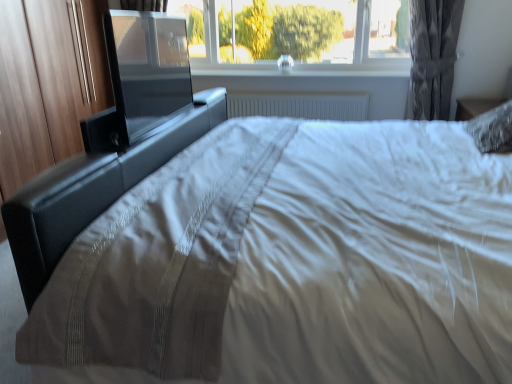
What is the approximate width of white plastic radiator at center?

The width of white plastic radiator at center is 9.64 centimeters.

At what (x,y) coordinates should I click in order to perform the action: click on white plastic radiator at center. Please return your answer as a coordinate pair (x, y). Looking at the image, I should click on (298, 105).

From a real-world perspective, is transparent glass window at upper center above or below white plastic radiator at center?

In terms of real-world spatial position, transparent glass window at upper center is above white plastic radiator at center.

Measure the distance from transparent glass window at upper center to white plastic radiator at center.

transparent glass window at upper center and white plastic radiator at center are 19.31 inches apart.

Is transparent glass window at upper center turned away from white plastic radiator at center?

transparent glass window at upper center does not have its back to white plastic radiator at center.

There is a white plastic radiator at center. In order to click on window above it (from a real-world perspective) in this screenshot , I will do `click(295, 31)`.

Looking at their sizes, would you say white plastic radiator at center is wider or thinner than gray textured curtain at upper right?

Clearly, white plastic radiator at center has less width compared to gray textured curtain at upper right.

Who is bigger, white plastic radiator at center or gray textured curtain at upper right?

Bigger between the two is gray textured curtain at upper right.

How different are the orientations of white plastic radiator at center and gray textured curtain at upper right in degrees?

The angular difference between white plastic radiator at center and gray textured curtain at upper right is 0.403 degrees.

Considering the positions of objects white plastic radiator at center and gray textured curtain at upper right in the image provided, who is behind, white plastic radiator at center or gray textured curtain at upper right?

white plastic radiator at center is more distant.

Considering the relative sizes of black leather bed frame at center and black glossy screen door at upper left in the image provided, is black leather bed frame at center smaller than black glossy screen door at upper left?

Actually, black leather bed frame at center might be larger than black glossy screen door at upper left.

Would you consider black leather bed frame at center to be distant from black glossy screen door at upper left?

No, there isn't a large distance between black leather bed frame at center and black glossy screen door at upper left.

Locate an element on the screen. This screenshot has width=512, height=384. screen door that appears above the black leather bed frame at center (from a real-world perspective) is located at coordinates (147, 69).

Looking at this image, who is shorter, gray textured curtain at upper right or transparent glass window at upper center?

transparent glass window at upper center.

Is gray textured curtain at upper right placed right next to transparent glass window at upper center?

No.

Looking at this image, is gray textured curtain at upper right smaller than transparent glass window at upper center?

Correct, gray textured curtain at upper right occupies less space than transparent glass window at upper center.

Identify the location of curtain on the right of transparent glass window at upper center. The width and height of the screenshot is (512, 384). (433, 55).

Which object is closer to the camera taking this photo, white plastic radiator at center or black leather bed frame at center?

black leather bed frame at center.

Which object is positioned more to the left, white plastic radiator at center or black leather bed frame at center?

Positioned to the left is black leather bed frame at center.

Would you say white plastic radiator at center is a long distance from black leather bed frame at center?

Yes, white plastic radiator at center and black leather bed frame at center are located far from each other.

Does point (131, 153) lie behind point (447, 90)?

No.

In the scene shown: Considering the relative positions of black leather bed frame at center and gray textured curtain at upper right in the image provided, is black leather bed frame at center to the right of gray textured curtain at upper right from the viewer's perspective?

Incorrect, black leather bed frame at center is not on the right side of gray textured curtain at upper right.

Is black leather bed frame at center situated inside gray textured curtain at upper right or outside?

The correct answer is: outside.

Considering their positions, is black glossy screen door at upper left located in front of or behind transparent glass window at upper center?

In the image, black glossy screen door at upper left appears in front of transparent glass window at upper center.

Is black glossy screen door at upper left bigger or smaller than transparent glass window at upper center?

Clearly, black glossy screen door at upper left is smaller in size than transparent glass window at upper center.

How different are the orientations of black glossy screen door at upper left and transparent glass window at upper center in degrees?

black glossy screen door at upper left and transparent glass window at upper center are facing 89.6 degrees away from each other.

From the image's perspective, would you say black glossy screen door at upper left is positioned over transparent glass window at upper center?

No, from the image's perspective, black glossy screen door at upper left is not over transparent glass window at upper center.

Where is `radiator on the left side of transparent glass window at upper center`? radiator on the left side of transparent glass window at upper center is located at coordinates (298, 105).

At what (x,y) coordinates should I click in order to perform the action: click on curtain in front of the white plastic radiator at center. Please return your answer as a coordinate pair (x, y). The height and width of the screenshot is (384, 512). Looking at the image, I should click on (433, 55).

Estimate the real-world distances between objects in this image. Which object is further from black glossy screen door at upper left, transparent glass window at upper center or white plastic radiator at center?

transparent glass window at upper center lies further to black glossy screen door at upper left than the other object.

Looking at the image, which one is located further to transparent glass window at upper center, black leather bed frame at center or black glossy screen door at upper left?

black glossy screen door at upper left is further to transparent glass window at upper center.

When comparing their distances from white plastic radiator at center, does black glossy screen door at upper left or black leather bed frame at center seem closer?

black leather bed frame at center is positioned closer to the anchor white plastic radiator at center.

Consider the image. Considering their positions, is black leather bed frame at center positioned further to transparent glass window at upper center than white plastic radiator at center?

black leather bed frame at center is further to transparent glass window at upper center.

Based on their spatial positions, is black glossy screen door at upper left or white plastic radiator at center closer to transparent glass window at upper center?

white plastic radiator at center is positioned closer to the anchor transparent glass window at upper center.

Based on their spatial positions, is black glossy screen door at upper left or transparent glass window at upper center further from black leather bed frame at center?

transparent glass window at upper center is further to black leather bed frame at center.

From the image, which object appears to be farther from transparent glass window at upper center, black glossy screen door at upper left or gray textured curtain at upper right?

Based on the image, black glossy screen door at upper left appears to be further to transparent glass window at upper center.

Estimate the real-world distances between objects in this image. Which object is closer to black leather bed frame at center, gray textured curtain at upper right or transparent glass window at upper center?

transparent glass window at upper center lies closer to black leather bed frame at center than the other object.

Identify the location of screen door between black leather bed frame at center and transparent glass window at upper center along the z-axis. The image size is (512, 384). (147, 69).

The width and height of the screenshot is (512, 384). In order to click on window between black glossy screen door at upper left and white plastic radiator at center along the z-axis in this screenshot , I will do `click(295, 31)`.

This screenshot has height=384, width=512. I want to click on curtain between black leather bed frame at center and transparent glass window at upper center in the front-back direction, so click(433, 55).

This screenshot has height=384, width=512. In order to click on curtain between black leather bed frame at center and white plastic radiator at center in the front-back direction in this screenshot , I will do `click(433, 55)`.